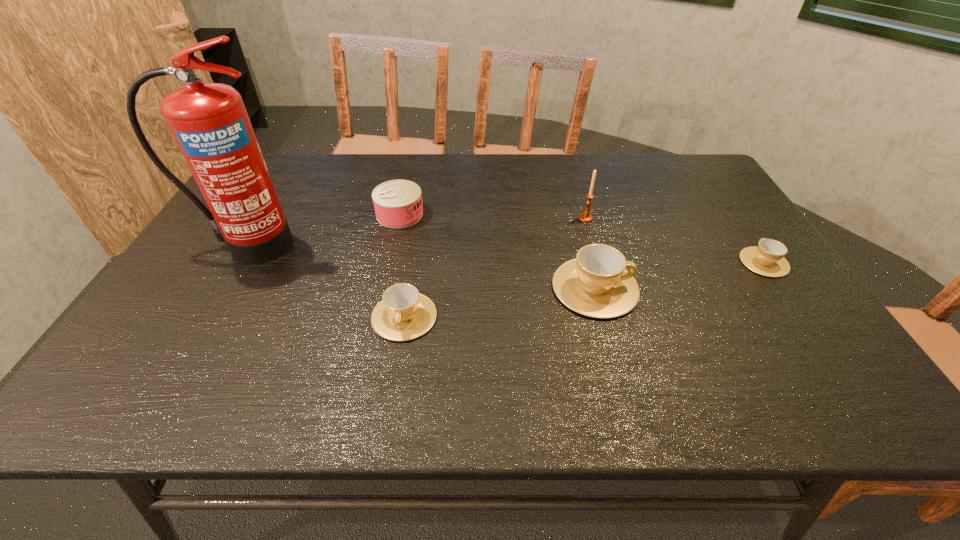
The image size is (960, 540). I want to click on empty location between the leftmost cup and the fifth shortest object, so click(495, 267).

Find the location of a particular element. the second closest object to the leftmost object is located at coordinates pos(403,314).

Identify which object is the nearest to the second shortest cup. Please provide its 2D coordinates. Your answer should be formatted as a tuple, i.e. [(x, y)], where the tuple contains the x and y coordinates of a point satisfying the conditions above.

[(398, 203)]

Identify which cup is the closest to the shortest cup. Please provide its 2D coordinates. Your answer should be formatted as a tuple, i.e. [(x, y)], where the tuple contains the x and y coordinates of a point satisfying the conditions above.

[(596, 284)]

Select which cup appears as the closest to the leftmost cup. Please provide its 2D coordinates. Your answer should be formatted as a tuple, i.e. [(x, y)], where the tuple contains the x and y coordinates of a point satisfying the conditions above.

[(596, 284)]